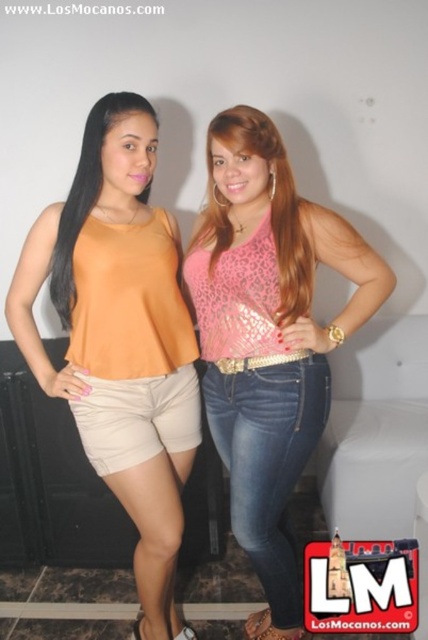
Question: Which point appears farthest from the camera in this image?

Choices:
 (A) (282, 572)
 (B) (177, 436)

Answer: (B)

Question: Which point is closer to the camera taking this photo?

Choices:
 (A) (160, 573)
 (B) (315, 221)

Answer: (B)

Question: Which of the following is the farthest from the observer?

Choices:
 (A) pink sequined top at center
 (B) matte orange tank top at left

Answer: (B)

Question: Is matte orange tank top at left closer to camera compared to pink sequined top at center?

Choices:
 (A) no
 (B) yes

Answer: (A)

Question: In this image, where is matte orange tank top at left located relative to pink sequined top at center?

Choices:
 (A) above
 (B) below

Answer: (A)

Question: Is matte orange tank top at left below pink sequined top at center?

Choices:
 (A) no
 (B) yes

Answer: (A)